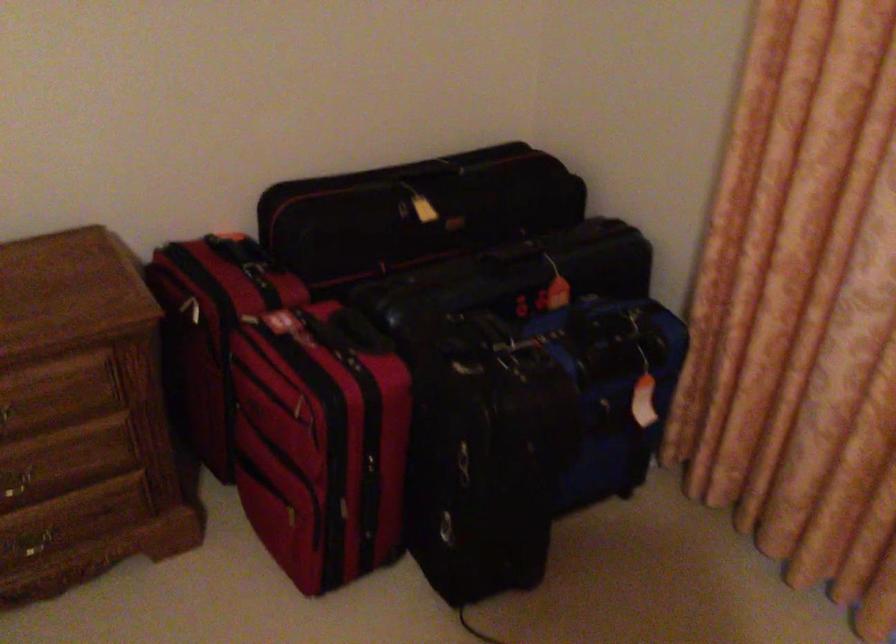
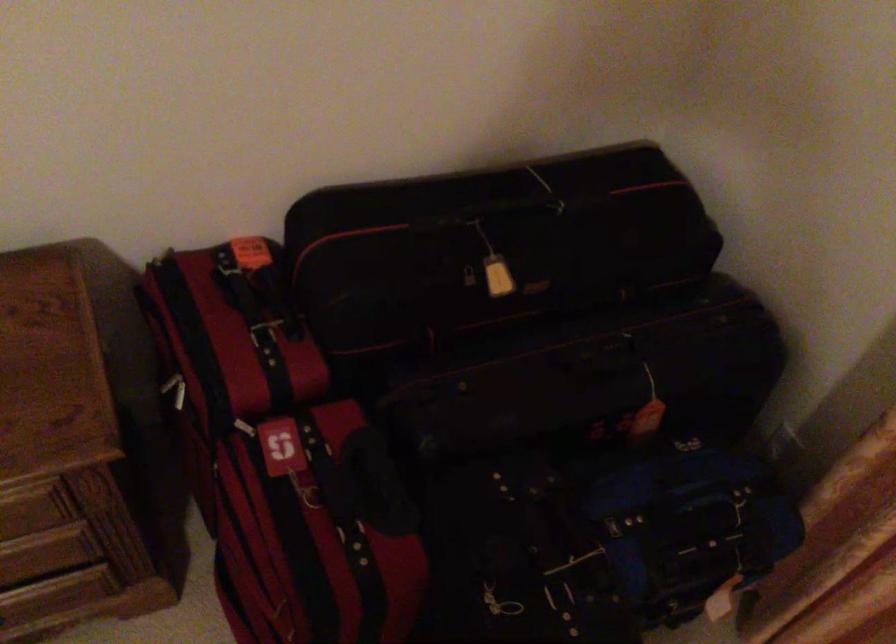
Where in the second image is the point corresponding to point (589, 321) from the first image?

(676, 507)